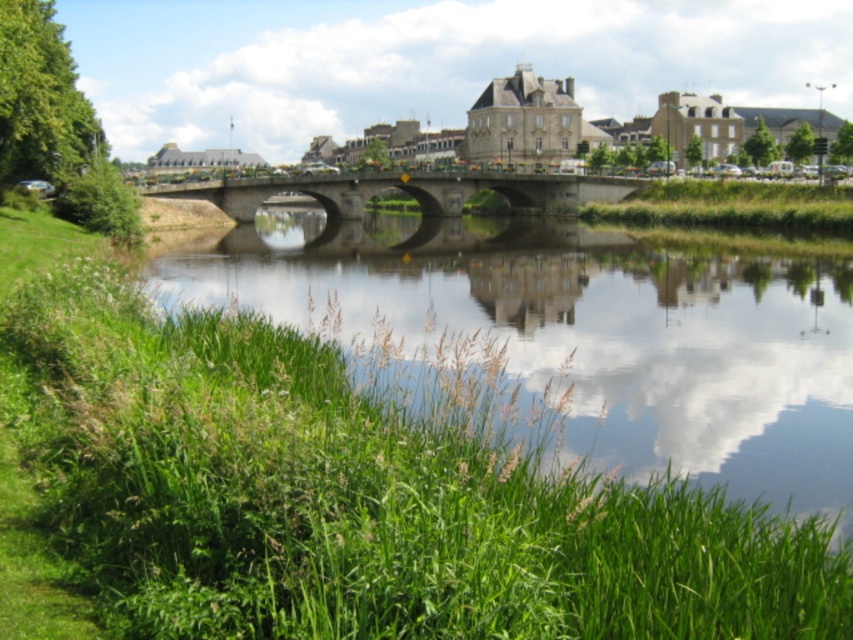
You are a landscape architect designing a new park. You have to decide whether to place a picnic area on the green grassy river at lower center or the concrete bridge at center. Based on their sizes, which location offers more space for the picnic area?

The green grassy river at lower center has a larger size compared to the concrete bridge at center, so it offers more space for the picnic area.

You are standing at the point with coordinates point (x=189, y=182) and want to walk to the point with coordinates point (x=734, y=296). Which direction should you move to reach your destination?

You should move forward because point (x=734, y=296) is in front of point (x=189, y=182).